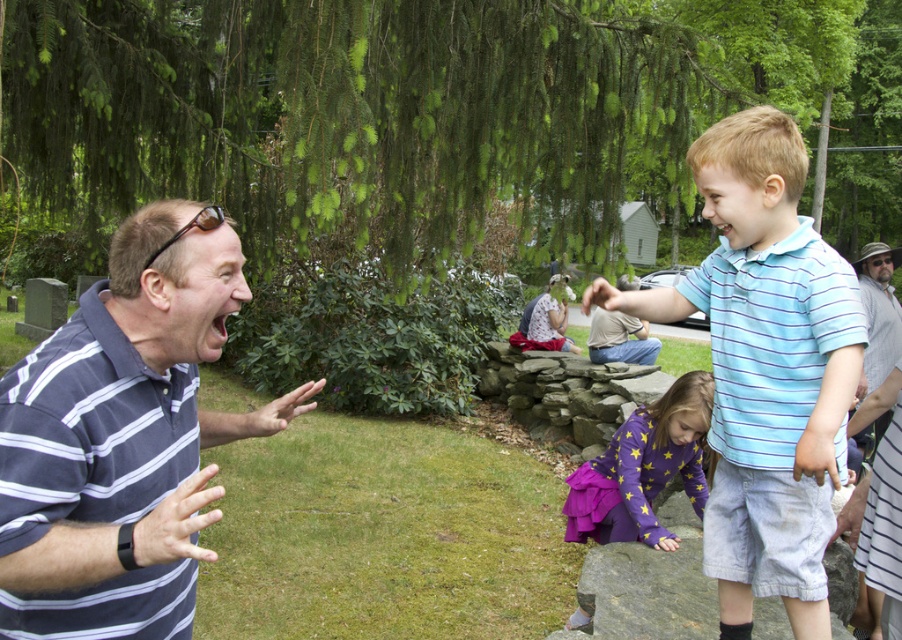
Is point (776, 545) positioned before point (185, 584)?

No.

Does point (788, 168) come farther from viewer compared to point (118, 396)?

Yes, point (788, 168) is farther from viewer.

Based on the photo, who is more distant from viewer, (729, 296) or (107, 348)?

Positioned behind is point (729, 296).

Image resolution: width=902 pixels, height=640 pixels. What are the coordinates of `light blue striped polo shirt at right` in the screenshot? It's located at (766, 369).

Who is lower down, purple satin dress at lower center or gray cotton shirt at upper right?

purple satin dress at lower center

Does purple satin dress at lower center appear on the left side of gray cotton shirt at upper right?

Yes, purple satin dress at lower center is to the left of gray cotton shirt at upper right.

Identify the location of purple satin dress at lower center. This screenshot has width=902, height=640. (643, 468).

Between dark gray striped polo shirt at left and purple satin dress at lower center, which one has more height?

With more height is purple satin dress at lower center.

Is the position of dark gray striped polo shirt at left more distant than that of purple satin dress at lower center?

No, dark gray striped polo shirt at left is closer to the viewer.

This screenshot has width=902, height=640. In order to click on dark gray striped polo shirt at left in this screenshot , I will do `click(90, 429)`.